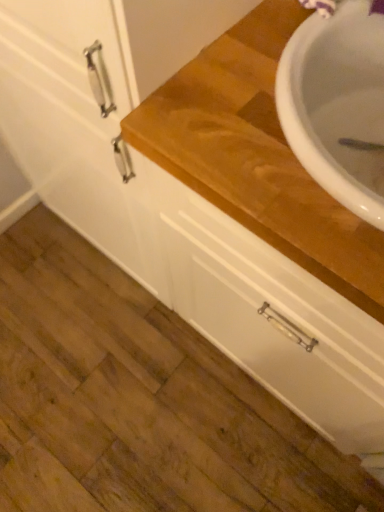
Question: Is wooden at upper right bigger than white matte drawer at center?

Choices:
 (A) yes
 (B) no

Answer: (A)

Question: Does wooden at upper right lie in front of white matte drawer at center?

Choices:
 (A) no
 (B) yes

Answer: (B)

Question: Considering the relative sizes of wooden at upper right and white matte drawer at center in the image provided, is wooden at upper right wider than white matte drawer at center?

Choices:
 (A) no
 (B) yes

Answer: (A)

Question: Is wooden at upper right not close to white matte drawer at center?

Choices:
 (A) no
 (B) yes

Answer: (A)

Question: Can you confirm if wooden at upper right is smaller than white matte drawer at center?

Choices:
 (A) no
 (B) yes

Answer: (A)

Question: Could you tell me if wooden at upper right is turned towards white matte drawer at center?

Choices:
 (A) yes
 (B) no

Answer: (A)

Question: Is white matte drawer at center smaller than wooden at upper right?

Choices:
 (A) yes
 (B) no

Answer: (A)

Question: Is white matte drawer at center shorter than wooden at upper right?

Choices:
 (A) yes
 (B) no

Answer: (A)

Question: Would you say wooden at upper right is part of white matte drawer at center's contents?

Choices:
 (A) no
 (B) yes

Answer: (A)

Question: Does white matte drawer at center appear on the right side of wooden at upper right?

Choices:
 (A) yes
 (B) no

Answer: (B)

Question: From the image's perspective, is white matte drawer at center under wooden at upper right?

Choices:
 (A) no
 (B) yes

Answer: (B)

Question: Can you confirm if white matte drawer at center is thinner than wooden at upper right?

Choices:
 (A) no
 (B) yes

Answer: (A)

Question: From the image's perspective, is white matte drawer at center positioned above or below wooden at upper right?

Choices:
 (A) below
 (B) above

Answer: (A)